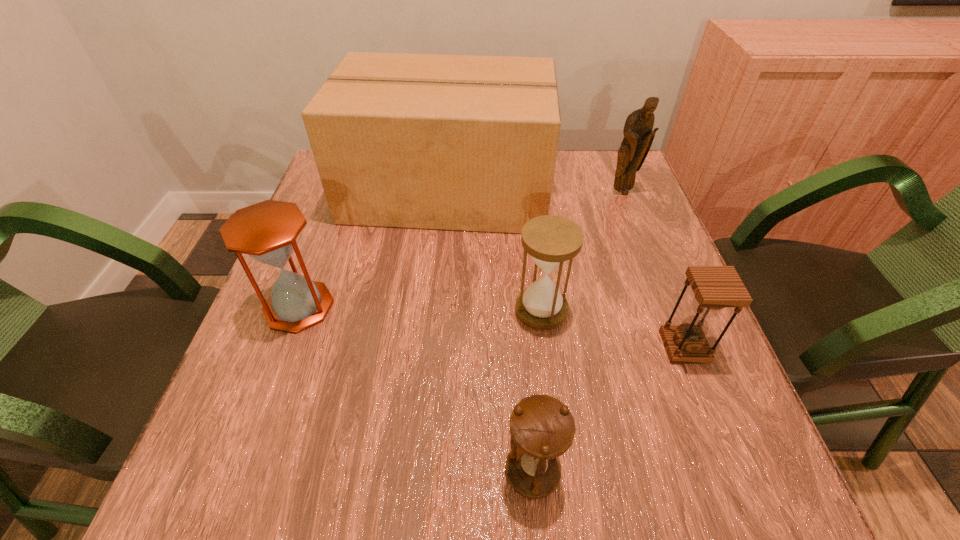
This screenshot has width=960, height=540. I want to click on box, so [x=455, y=142].

Where is `figurine`? figurine is located at coordinates (638, 136).

Find the location of a particular element. This screenshot has height=540, width=960. the leftmost hourglass is located at coordinates (267, 231).

Identify the location of the rightmost hourglass. The height and width of the screenshot is (540, 960). (715, 287).

You are a GUI agent. You are given a task and a screenshot of the screen. Output one action in this format:
    pyautogui.click(x=<x>, y=<y>)
    Task: Click on the nearest hourglass
    
    Given the screenshot: What is the action you would take?
    pyautogui.click(x=542, y=428)

Locate an element on the screen. This screenshot has height=540, width=960. vacant space located on the right of the box is located at coordinates (594, 191).

At what (x,y) coordinates should I click in order to perform the action: click on free space located on the front-facing side of the figurine. Please return your answer as a coordinate pair (x, y). The image size is (960, 540). Looking at the image, I should click on (662, 298).

You are a GUI agent. You are given a task and a screenshot of the screen. Output one action in this format:
    pyautogui.click(x=<x>, y=<y>)
    Task: Click on the vacant space located 0.240m on the right of the leftmost hourglass
    This screenshot has width=960, height=540.
    Given the screenshot: What is the action you would take?
    pyautogui.click(x=452, y=307)

The width and height of the screenshot is (960, 540). In order to click on free location located 0.100m on the left of the rightmost hourglass in this screenshot , I will do `click(611, 347)`.

You are a GUI agent. You are given a task and a screenshot of the screen. Output one action in this format:
    pyautogui.click(x=<x>, y=<y>)
    Task: Click on the vacant space located 0.280m on the back of the nearest object
    
    Given the screenshot: What is the action you would take?
    tap(519, 307)